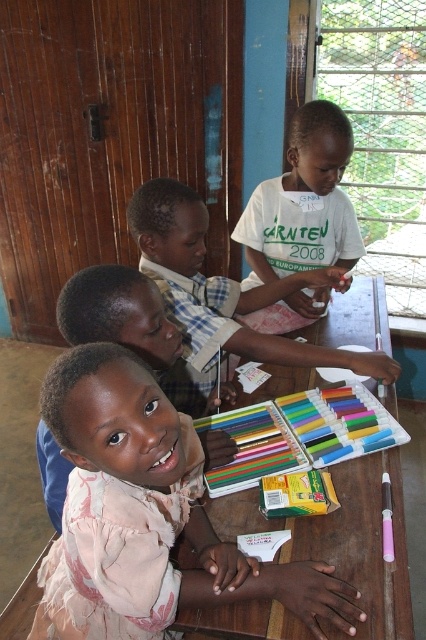
Question: Observing the image, what is the correct spatial positioning of pink fabric child at center in reference to matte white shirt at center?

Choices:
 (A) above
 (B) below

Answer: (B)

Question: Does matte white shirt at center come in front of matte pink dress at center?

Choices:
 (A) no
 (B) yes

Answer: (A)

Question: Is matte white shirt at center to the right of matte pink dress at center from the viewer's perspective?

Choices:
 (A) no
 (B) yes

Answer: (B)

Question: Among these objects, which one is farthest from the camera?

Choices:
 (A) matte white shirt at center
 (B) matte pink dress at center
 (C) pink fabric child at center
 (D) white cotton shirt at center

Answer: (D)

Question: Among these points, which one is farthest from the camera?

Choices:
 (A) [x=201, y=298]
 (B) [x=144, y=275]
 (C) [x=299, y=609]

Answer: (A)

Question: Which point appears farthest from the camera in this image?

Choices:
 (A) (351, 237)
 (B) (236, 291)
 (C) (244, 595)

Answer: (A)